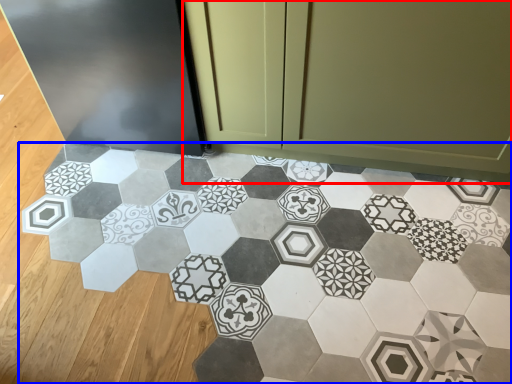
Question: Among these objects, which one is nearest to the camera, cabinetry (highlighted by a red box) or ceramic tile (highlighted by a blue box)?

Choices:
 (A) cabinetry
 (B) ceramic tile

Answer: (B)